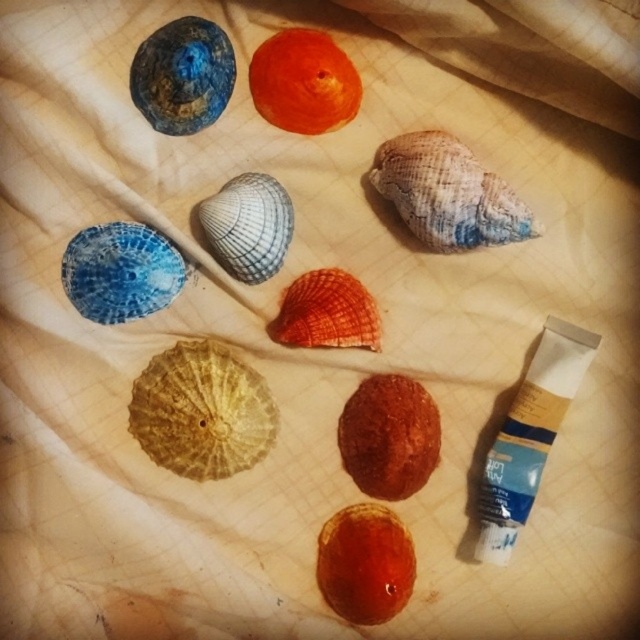
Who is shorter, glossy orange shell at center or orange matte shell at upper center?

orange matte shell at upper center is shorter.

Which is more to the left, glossy orange shell at center or orange matte shell at upper center?

orange matte shell at upper center is more to the left.

Which is in front, point (410, 560) or point (289, 76)?

Point (289, 76)

Where is `glossy orange shell at center`? The image size is (640, 640). glossy orange shell at center is located at coordinates (365, 563).